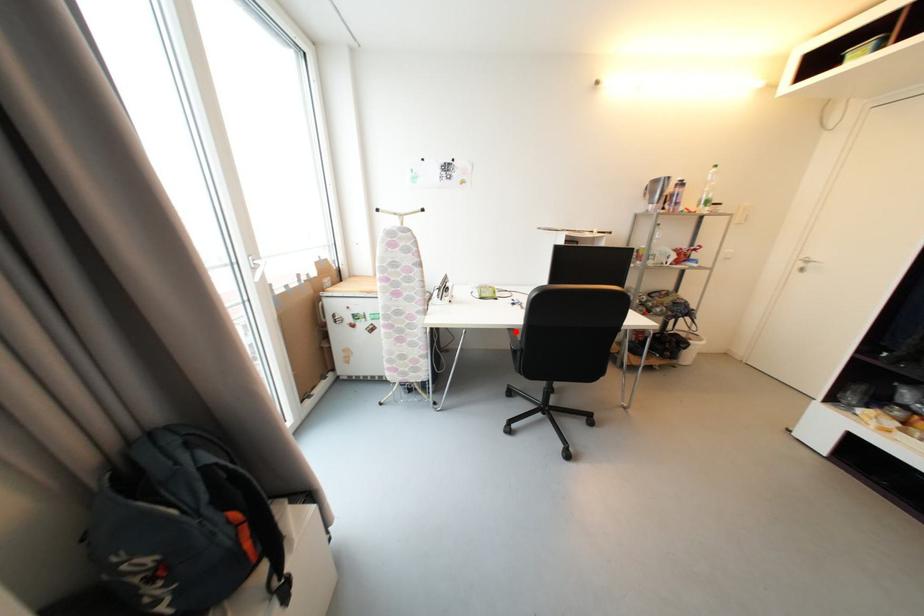
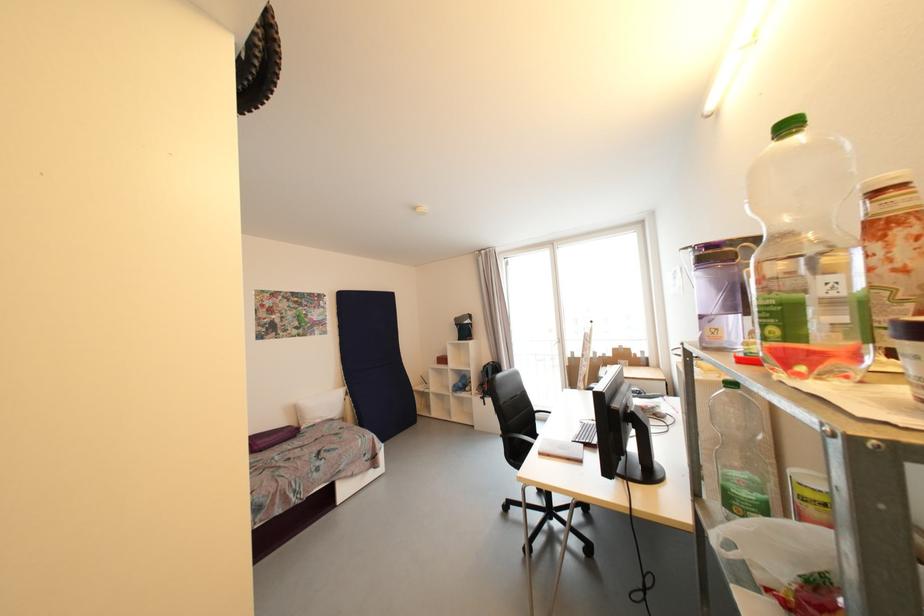
Question: A red point is marked in image1. In image2, is the corresponding 3D point closer to the camera or farther? Reply with the corresponding letter.

Choices:
 (A) The corresponding 3D point is closer.
 (B) The corresponding 3D point is farther.

Answer: (B)